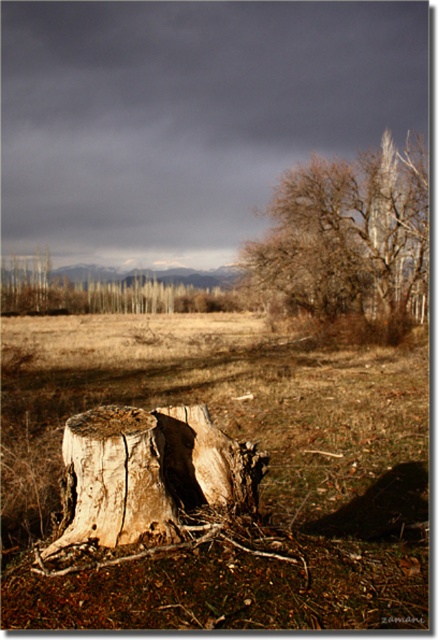
You are standing at the origin point in the scene. The brown wood stump at center is marked at coordinates. Can you determine if the stump is positioned to the right or left of the center point?

The brown wood stump at center is located at point (233,445), which means it is positioned to the right of the center point since the x coordinate is greater than 0.5.

You are standing at the origin point in the scene. The brown wood stump at center is positioned at coordinates 0.697 along the x and 0.534 along the y. If you move directly towards the stump, will you reach it before reaching the background line of trees?

The brown wood stump at center is located at point (233, 445). Since it is at the center and the coordinates suggest it is closer to the foreground, you will reach it before the background line of trees.